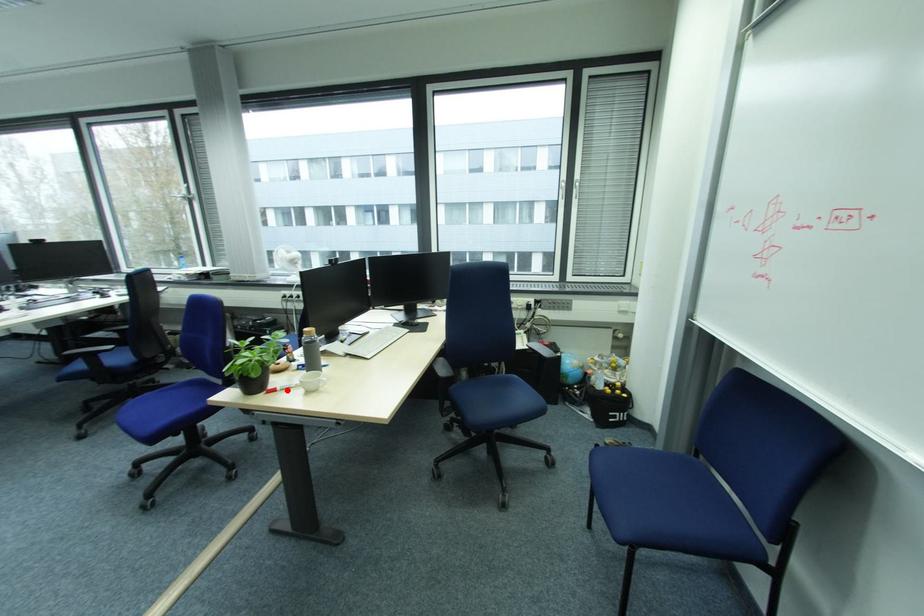
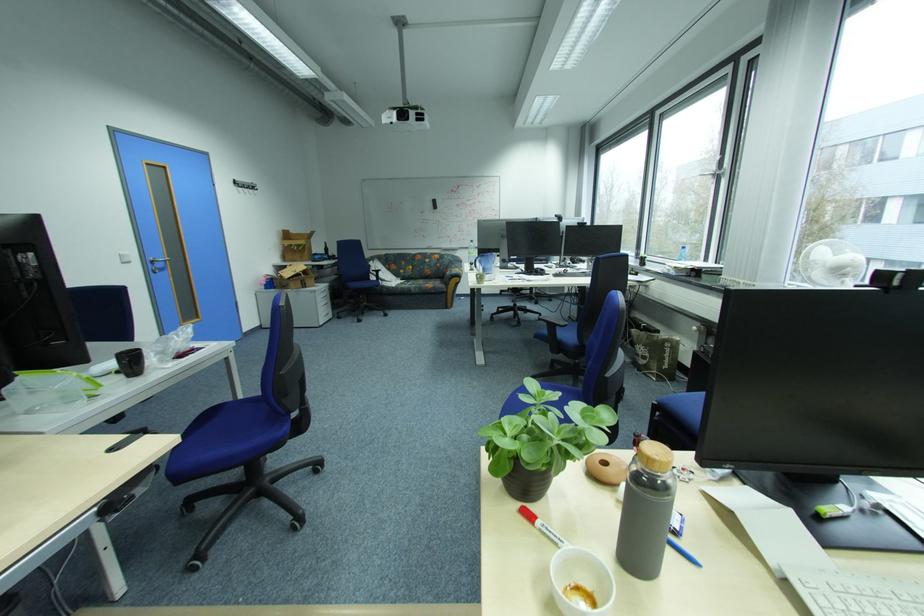
In the second image, find the point that corresponds to the highlighted location in the first image.

(546, 525)